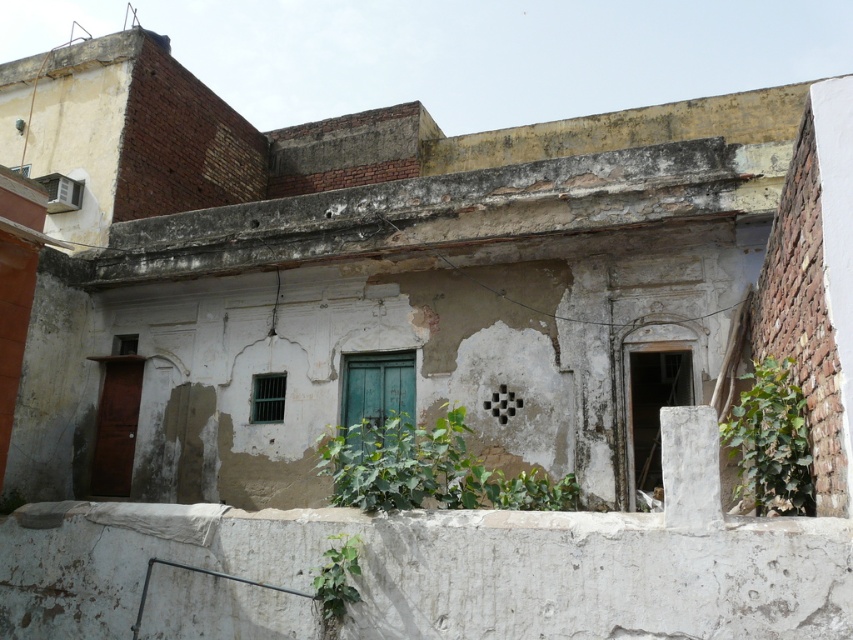
Does green leafy plant at center appear over green leafy plant at lower center?

No, green leafy plant at center is not above green leafy plant at lower center.

Who is more forward, (526, 490) or (331, 605)?

Point (331, 605) is more forward.

Between point (434, 422) and point (354, 588), which one is positioned in front?

Point (354, 588)

Find the location of a particular element. The height and width of the screenshot is (640, 853). green leafy plant at center is located at coordinates (427, 468).

This screenshot has height=640, width=853. What do you see at coordinates (770, 444) in the screenshot?
I see `green leafy plant at right` at bounding box center [770, 444].

Can you confirm if green leafy plant at right is positioned below green leafy plant at lower center?

Actually, green leafy plant at right is above green leafy plant at lower center.

Where is `green leafy plant at right`? The height and width of the screenshot is (640, 853). green leafy plant at right is located at coordinates (770, 444).

Does green leafy plant at center have a greater width compared to green leafy plant at right?

In fact, green leafy plant at center might be narrower than green leafy plant at right.

Between point (341, 493) and point (791, 433), which one is positioned in front?

Point (791, 433) is in front.

This screenshot has width=853, height=640. What are the coordinates of `green leafy plant at center` in the screenshot? It's located at (427, 468).